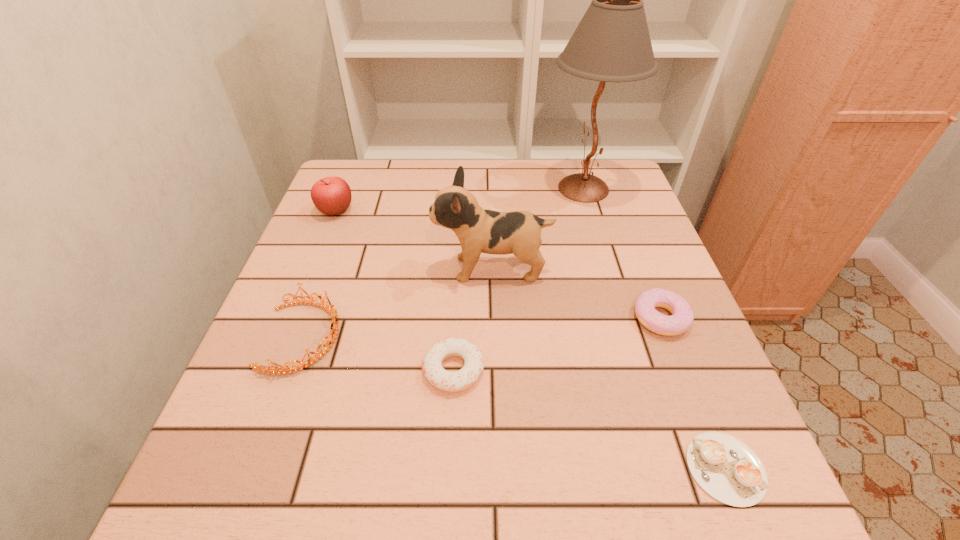
Locate an element on the screen. This screenshot has width=960, height=540. table lamp is located at coordinates (612, 43).

Locate an element on the screen. Image resolution: width=960 pixels, height=540 pixels. the second tallest object is located at coordinates (479, 230).

Find the location of a particular element. Image resolution: width=960 pixels, height=540 pixels. puppy is located at coordinates [x=479, y=230].

Find the location of a particular element. The width and height of the screenshot is (960, 540). the third tallest object is located at coordinates (332, 196).

Find the location of a particular element. Image resolution: width=960 pixels, height=540 pixels. tiara is located at coordinates (332, 311).

This screenshot has width=960, height=540. I want to click on the right doughnut, so click(682, 317).

The image size is (960, 540). Find the location of `the nearer doughnut`. the nearer doughnut is located at coordinates (444, 380).

Where is `cappuccino`? Image resolution: width=960 pixels, height=540 pixels. cappuccino is located at coordinates (727, 469).

This screenshot has width=960, height=540. What are the coordinates of `the shortest object` in the screenshot? It's located at 727,469.

This screenshot has height=540, width=960. Identify the location of vacant area located on the front-facing side of the tallest object. (474, 188).